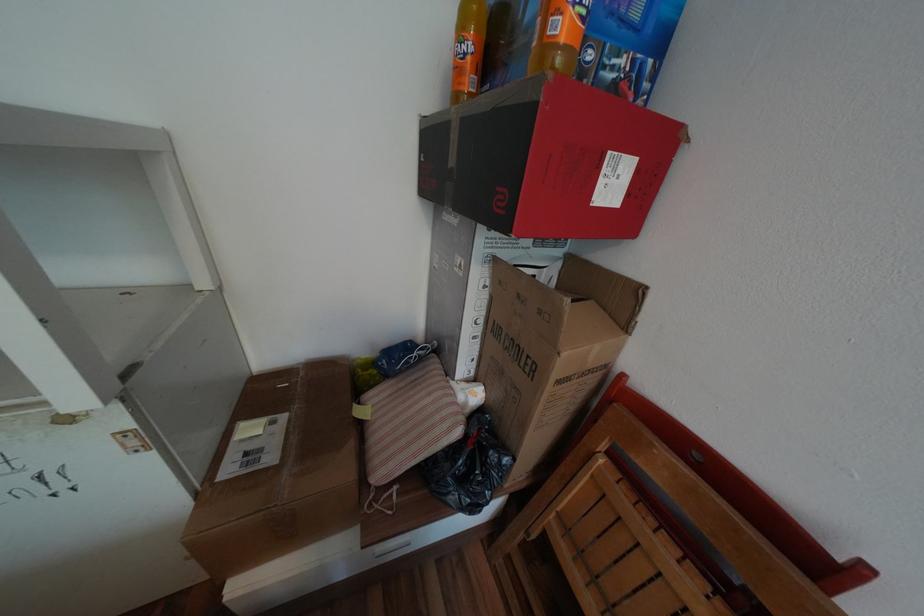
This screenshot has width=924, height=616. I want to click on silver drawer handle, so click(391, 548).